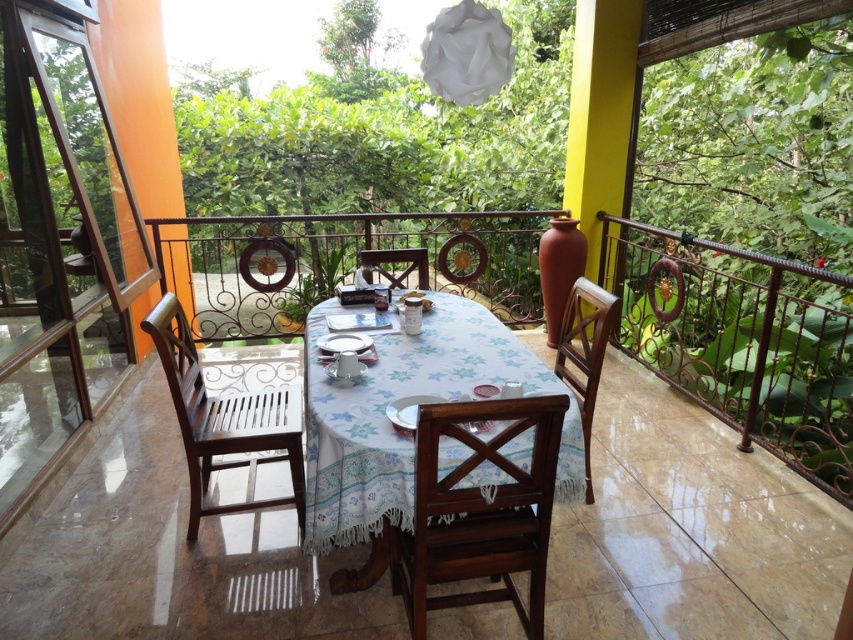
Question: Which object is closer to the camera taking this photo?

Choices:
 (A) mahogany wood chair at center
 (B) white floral tablecloth at center

Answer: (A)

Question: Can you confirm if mahogany wood chair at center is wider than brown wooden chair at left?

Choices:
 (A) yes
 (B) no

Answer: (B)

Question: Considering the relative positions of wooden chair at right and wooden chair at center in the image provided, where is wooden chair at right located with respect to wooden chair at center?

Choices:
 (A) right
 (B) left

Answer: (A)

Question: Among these objects, which one is farthest from the camera?

Choices:
 (A) brown wooden chair at left
 (B) wooden chair at right

Answer: (A)

Question: Which object is positioned closest to the brown wooden chair at left?

Choices:
 (A) white floral tablecloth at center
 (B) wooden chair at center

Answer: (A)

Question: Is white floral tablecloth at center positioned behind wooden chair at right?

Choices:
 (A) yes
 (B) no

Answer: (B)